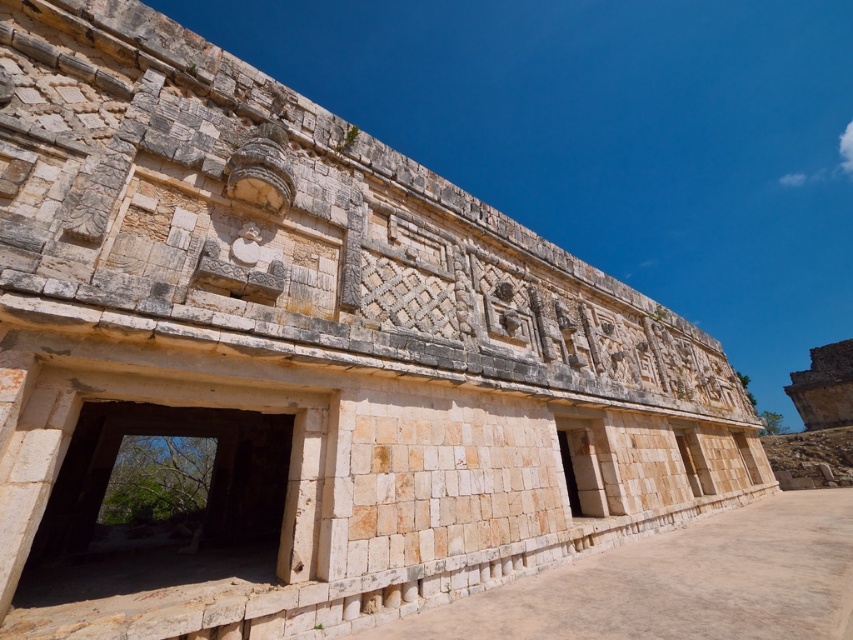
Is point (157, 536) less distant than point (563, 451)?

Yes.

Can you confirm if light beige stone archway at center is wider than light beige stone door at center?

Indeed, light beige stone archway at center has a greater width compared to light beige stone door at center.

The width and height of the screenshot is (853, 640). I want to click on light beige stone archway at center, so click(x=161, y=488).